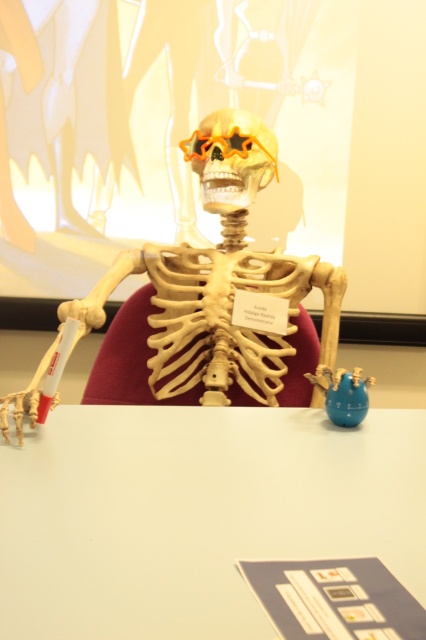
Question: Which of the following is the farthest from the observer?

Choices:
 (A) (155, 632)
 (B) (235, 115)

Answer: (B)

Question: Is the position of white matte table at center less distant than that of orange plastic skull at center?

Choices:
 (A) yes
 (B) no

Answer: (A)

Question: Is white matte table at center thinner than orange plastic skull at center?

Choices:
 (A) yes
 (B) no

Answer: (B)

Question: Which of the following is the closest to the observer?

Choices:
 (A) (203, 134)
 (B) (39, 532)

Answer: (B)

Question: In this image, where is white matte table at center located relative to orange plastic skull at center?

Choices:
 (A) left
 (B) right

Answer: (A)